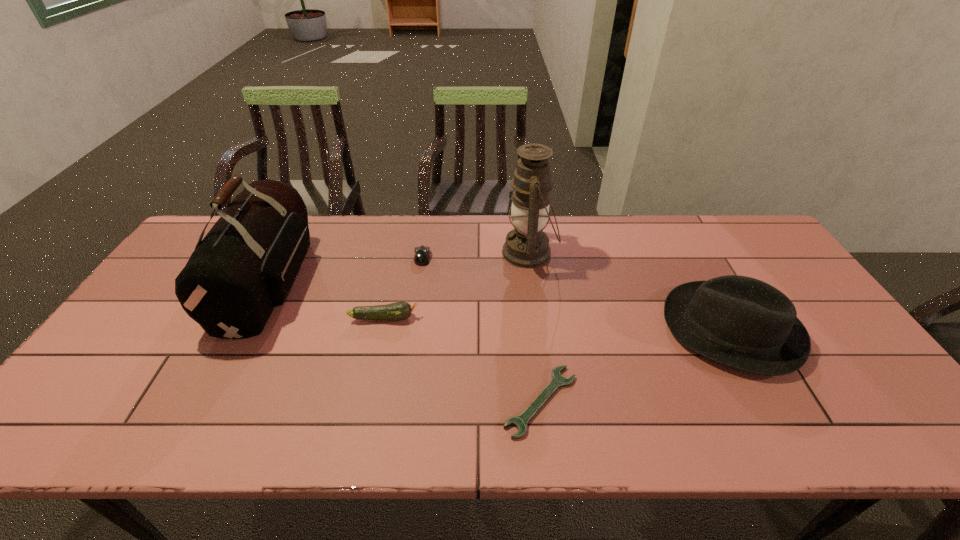
Locate an element on the screen. free space between the leftmost object and the fedora is located at coordinates (500, 306).

You are a GUI agent. You are given a task and a screenshot of the screen. Output one action in this format:
    pyautogui.click(x=<x>, y=<y>)
    Task: Click on the object that is the third closest one to the oil lamp
    
    Given the screenshot: What is the action you would take?
    pyautogui.click(x=397, y=311)

Select which object appears as the closest to the oil lamp. Please provide its 2D coordinates. Your answer should be formatted as a tuple, i.e. [(x, y)], where the tuple contains the x and y coordinates of a point satisfying the conditions above.

[(422, 254)]

At what (x,y) coordinates should I click in order to perform the action: click on vacant point that satisfies the following two spatial constraints: 1. on the front pocket of the leftmost object; 2. on the back side of the fedora. Please return your answer as a coordinate pair (x, y). This screenshot has width=960, height=540. Looking at the image, I should click on (245, 329).

At what (x,y) coordinates should I click in order to perform the action: click on free space that satisfies the following two spatial constraints: 1. on the back side of the wrench; 2. at the blossom end of the third shortest object. Please return your answer as a coordinate pair (x, y). This screenshot has width=960, height=540. Looking at the image, I should click on (531, 318).

Find the location of a particular element. This screenshot has width=960, height=540. free location that satisfies the following two spatial constraints: 1. on the front pocket of the duffel bag; 2. on the left side of the fedora is located at coordinates (245, 329).

I want to click on free space that satisfies the following two spatial constraints: 1. on the back side of the fifth tallest object; 2. on the left side of the oil lamp, so click(x=423, y=253).

Locate an element on the screen. vacant space that satisfies the following two spatial constraints: 1. at the blossom end of the wrench; 2. on the left side of the zucchini is located at coordinates (366, 401).

In order to click on blank space that satisfies the following two spatial constraints: 1. on the front pocket of the fedora; 2. on the left side of the duffel bag in this screenshot , I will do `click(245, 329)`.